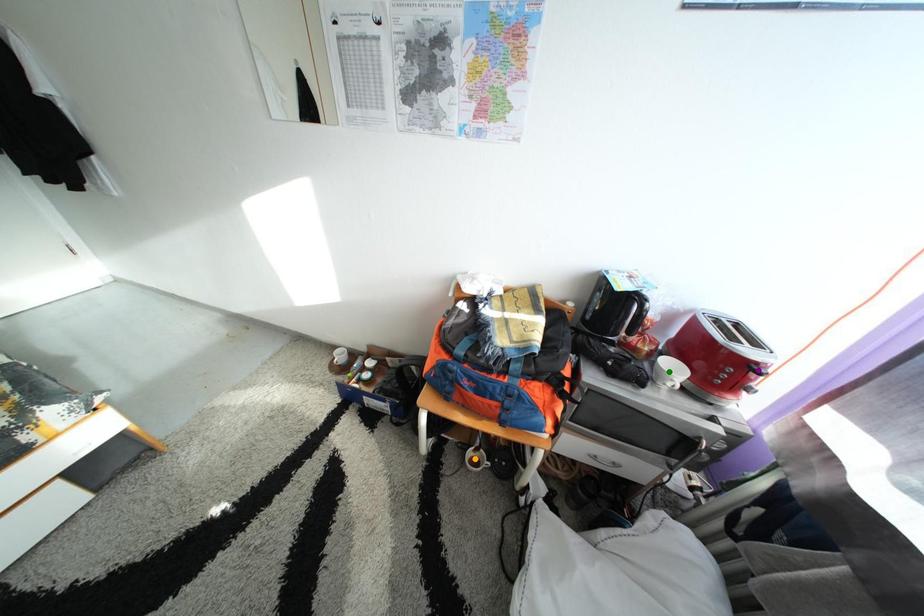
From the picture: Order these from nearest to farthest:
- orange point
- green point
- purple point

purple point, green point, orange point